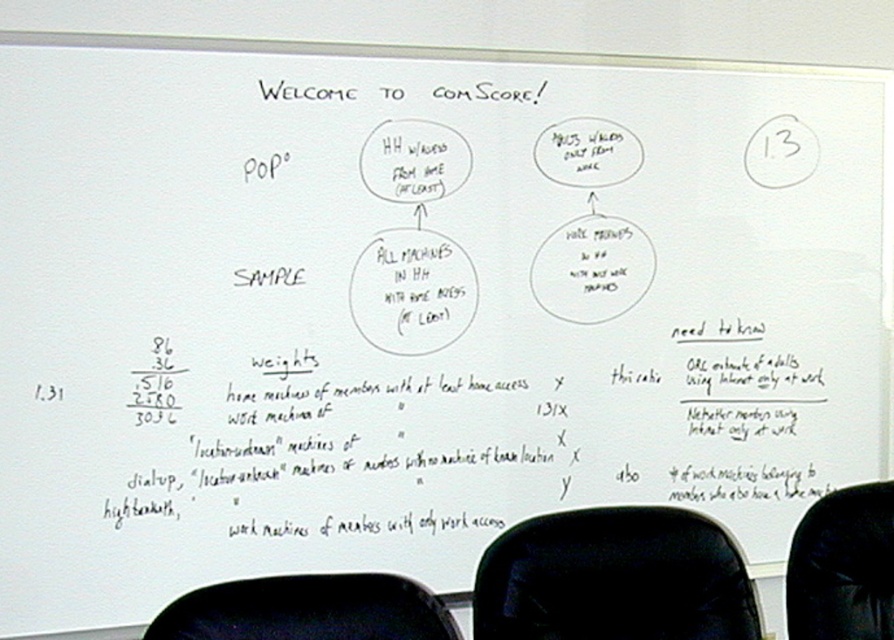
You are sitting in a room with a whiteboard and need to reach the top of the whiteboard to write something. Which chair, the black fabric swivel chair at lower center or the black fabric armchair at lower center, would be more suitable for reaching the top?

The black fabric swivel chair at lower center is much taller than the black fabric armchair at lower center, so it would be more suitable for reaching the top of the whiteboard.

You are a visitor sitting in the black fabric swivel chair at lower center and want to move to the black fabric armchair at lower right. Considering the size difference between the two chairs, which chair would require more space to move around comfortably?

The black fabric swivel chair at lower center requires more space to move around comfortably because it has a larger size compared to the black fabric armchair at lower right.